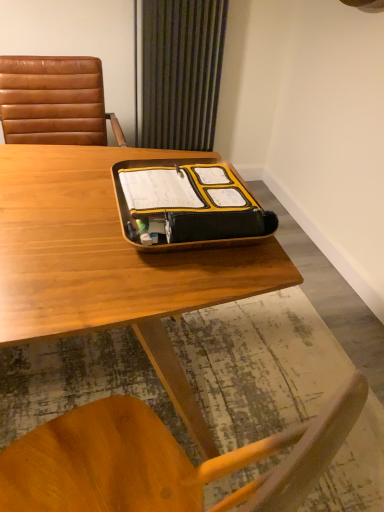
Find the location of a particular element. free spot in front of yellow matte tray at center is located at coordinates (143, 279).